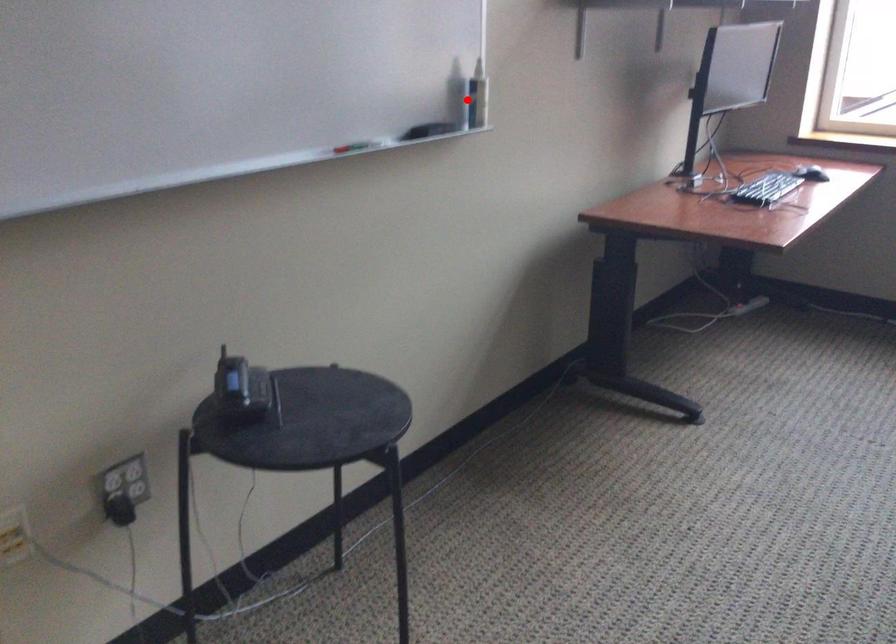
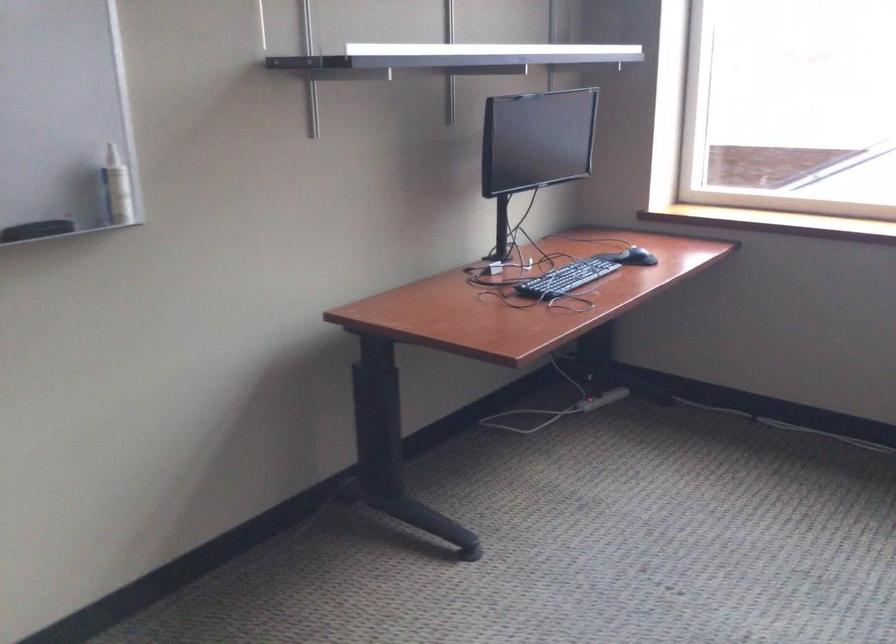
Question: A red point is marked in image1. In image2, is the corresponding 3D point closer to the camera or farther? Reply with the corresponding letter.

Choices:
 (A) The corresponding 3D point is closer.
 (B) The corresponding 3D point is farther.

Answer: (A)